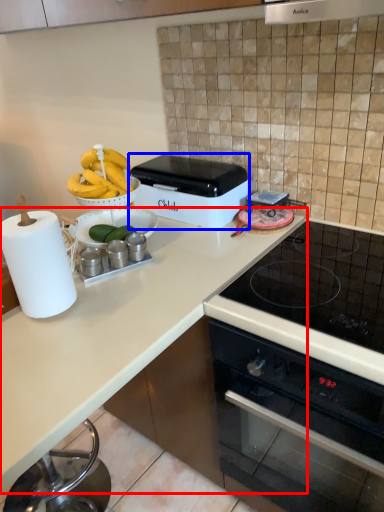
Question: Which of the following is the farthest to the observer, countertop (highlighted by a red box) or kitchen appliance (highlighted by a blue box)?

Choices:
 (A) countertop
 (B) kitchen appliance

Answer: (B)